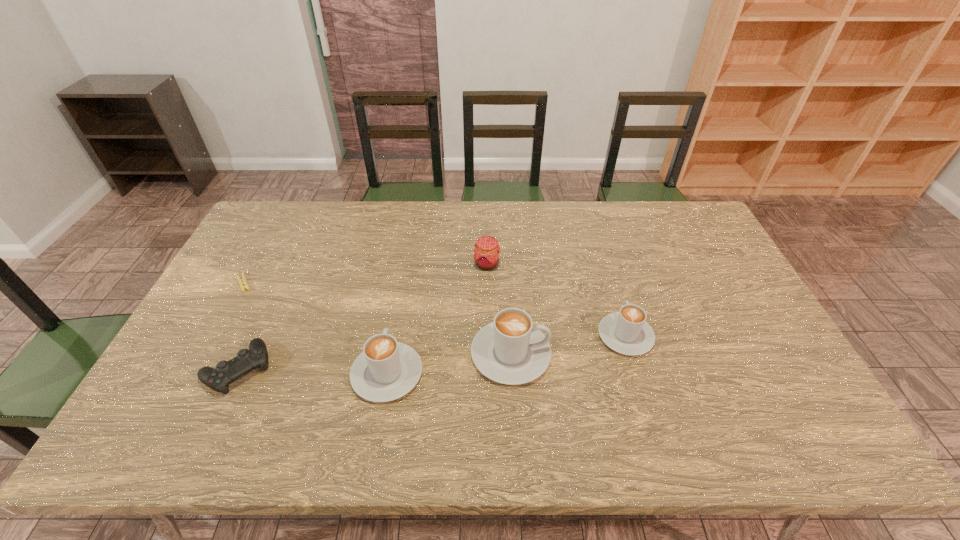
Find the location of a particular element. the third object from left to right is located at coordinates (386, 370).

The width and height of the screenshot is (960, 540). I want to click on the second shortest cappuccino, so click(x=386, y=370).

Identify the location of the second cappuccino from right to left. The image size is (960, 540). (511, 350).

Find the location of a particular element. This screenshot has height=540, width=960. the rightmost cappuccino is located at coordinates (627, 332).

This screenshot has width=960, height=540. What are the coordinates of `the rightmost object` in the screenshot? It's located at (627, 332).

You are a GUI agent. You are given a task and a screenshot of the screen. Output one action in this format:
    pyautogui.click(x=<x>, y=<y>)
    Task: Click on the jam
    
    Given the screenshot: What is the action you would take?
    pyautogui.click(x=487, y=251)

The image size is (960, 540). I want to click on the shortest object, so click(243, 285).

At what (x,y) coordinates should I click in order to perform the action: click on the fifth tallest object. Please return your answer as a coordinate pair (x, y). The width and height of the screenshot is (960, 540). Looking at the image, I should click on (246, 361).

Find the location of a particular element. Image resolution: width=960 pixels, height=540 pixels. vacant space located to the right of the fifth shortest object is located at coordinates (400, 299).

Image resolution: width=960 pixels, height=540 pixels. What are the coordinates of `vacant region located to the right of the fifth shortest object` in the screenshot? It's located at (407, 261).